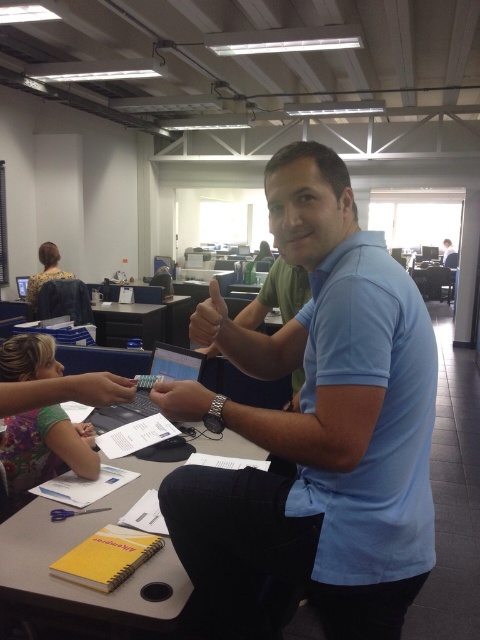
Is yellow spiral notebook at lower left above matte black pen at lower left?

No.

Based on the photo, is yellow spiral notebook at lower left closer to camera compared to matte black pen at lower left?

No, it is behind matte black pen at lower left.

Find the location of a particular element. Image resolution: width=480 pixels, height=640 pixels. yellow spiral notebook at lower left is located at coordinates (75, 544).

The image size is (480, 640). I want to click on yellow spiral notebook at lower left, so click(x=75, y=544).

Is light blue cotton shirt at center to the left of matte black laptop at center from the viewer's perspective?

In fact, light blue cotton shirt at center is to the right of matte black laptop at center.

Does light blue cotton shirt at center appear over matte black laptop at center?

Indeed, light blue cotton shirt at center is positioned over matte black laptop at center.

Which is in front, point (350, 525) or point (148, 413)?

Positioned in front is point (350, 525).

Where is `light blue cotton shirt at center`? light blue cotton shirt at center is located at coordinates (322, 435).

Between matte black laptop at center and matte plastic pen at lower left, which one appears on the left side from the viewer's perspective?

Positioned to the left is matte plastic pen at lower left.

Is point (159, 374) closer to camera compared to point (93, 438)?

No, (159, 374) is behind (93, 438).

Is point (154, 349) farther from camera compared to point (72, 424)?

Yes, it is behind point (72, 424).

Find the location of a particular element. matte black laptop at center is located at coordinates (149, 387).